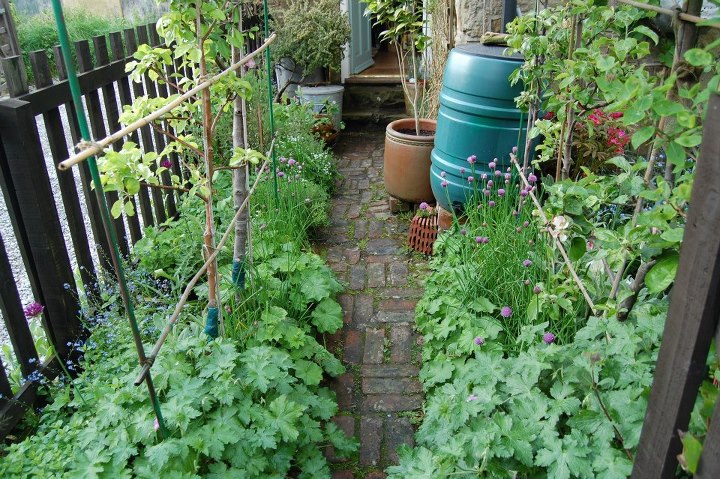
This screenshot has width=720, height=479. I want to click on bottom of white door, so click(364, 53).